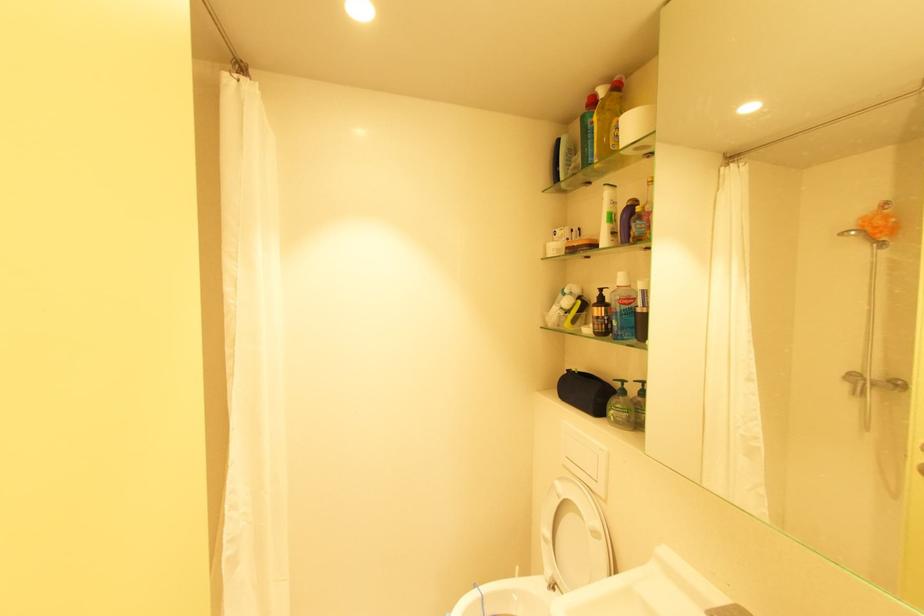
The location [585,392] corresponds to which object?

It corresponds to the black toiletry bag in the image.